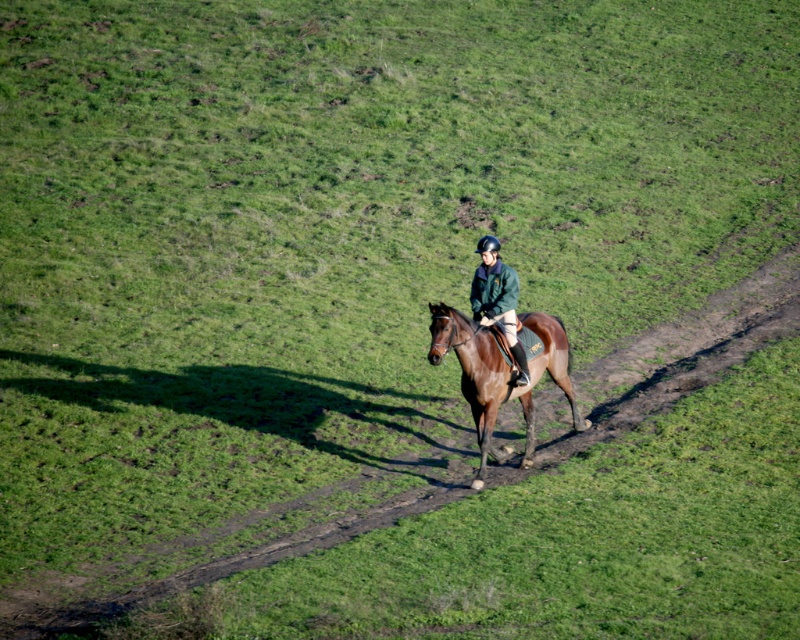
Question: Does brown glossy horse at center have a smaller size compared to green matte jacket at center?

Choices:
 (A) yes
 (B) no

Answer: (B)

Question: Among these points, which one is nearest to the camera?

Choices:
 (A) (490, 410)
 (B) (484, 246)

Answer: (A)

Question: Among these points, which one is farthest from the camera?

Choices:
 (A) (462, 392)
 (B) (508, 333)

Answer: (A)

Question: Can you confirm if brown glossy horse at center is bigger than green matte jacket at center?

Choices:
 (A) no
 (B) yes

Answer: (B)

Question: Is brown glossy horse at center to the left of green matte jacket at center from the viewer's perspective?

Choices:
 (A) yes
 (B) no

Answer: (B)